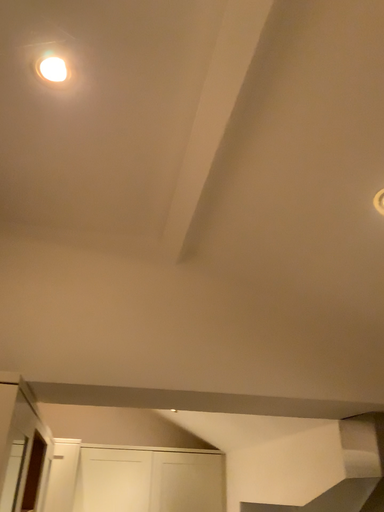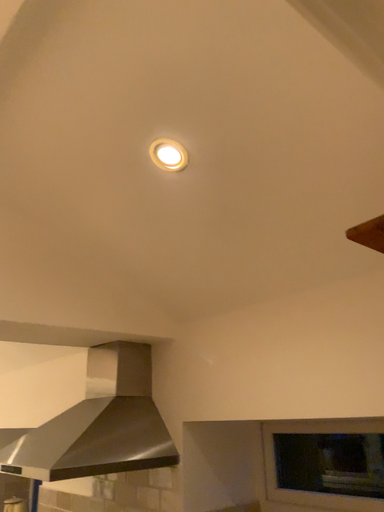
Question: Which way did the camera rotate in the video?

Choices:
 (A) rotated left
 (B) rotated right

Answer: (B)